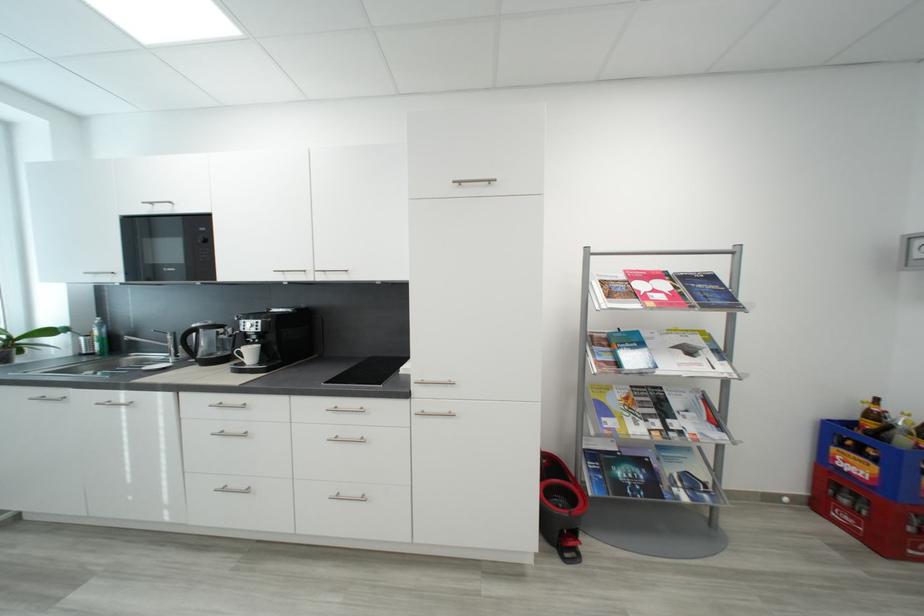
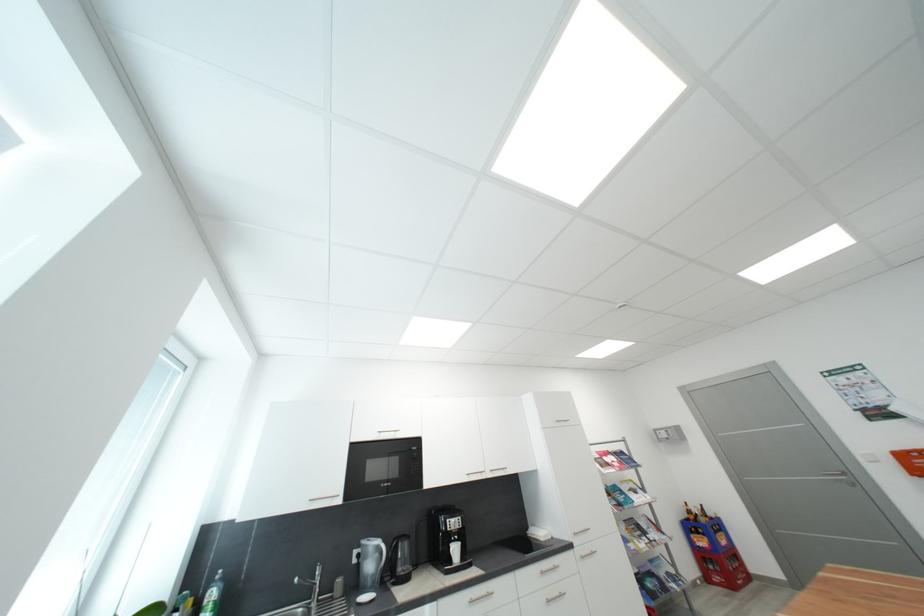
Where in the second image is the point corresponding to (x=257, y=354) from the first image?

(463, 552)